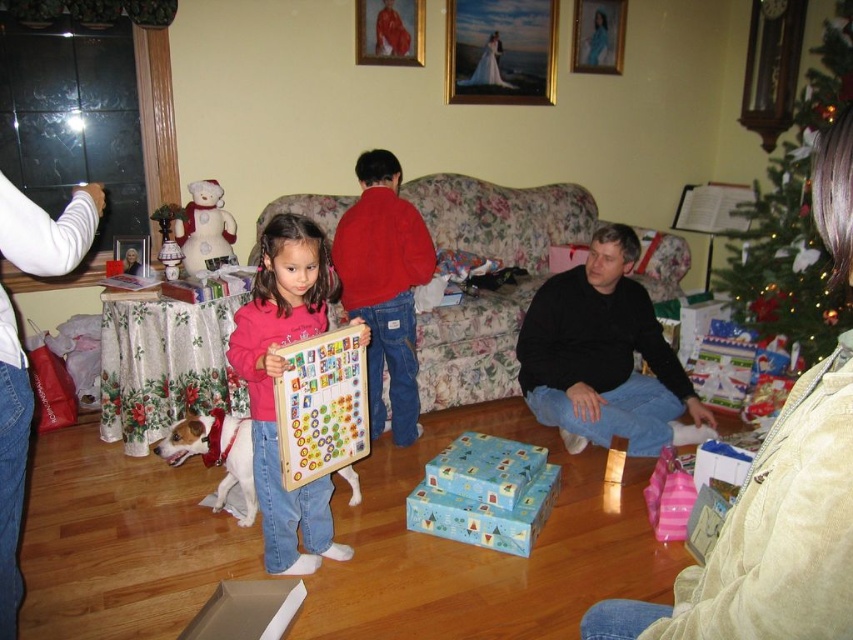
Which is behind, point (479, 49) or point (612, 4)?

Positioned behind is point (612, 4).

Which is behind, point (471, 44) or point (614, 8)?

Point (614, 8)

Where is `metallic gold picture frame at upper center`? The height and width of the screenshot is (640, 853). metallic gold picture frame at upper center is located at coordinates (502, 51).

Who is positioned more to the left, white plush bear at upper left or metallic photo frame at center?

metallic photo frame at center

Is white plush bear at upper left positioned before metallic photo frame at center?

No.

Where is `white plush bear at upper left`? This screenshot has width=853, height=640. white plush bear at upper left is located at coordinates (204, 227).

Find the location of a particular element. This screenshot has height=640, width=853. white plush bear at upper left is located at coordinates pyautogui.click(x=204, y=227).

Is wooden puzzle board at center above metallic gold picture frame at upper center?

No.

Based on the photo, can you confirm if wooden puzzle board at center is shorter than metallic gold picture frame at upper center?

Correct, wooden puzzle board at center is not as tall as metallic gold picture frame at upper center.

The image size is (853, 640). What are the coordinates of `wooden puzzle board at center` in the screenshot? It's located at (322, 406).

At what (x,y) coordinates should I click in order to perform the action: click on wooden puzzle board at center. Please return your answer as a coordinate pair (x, y). The image size is (853, 640). Looking at the image, I should click on (322, 406).